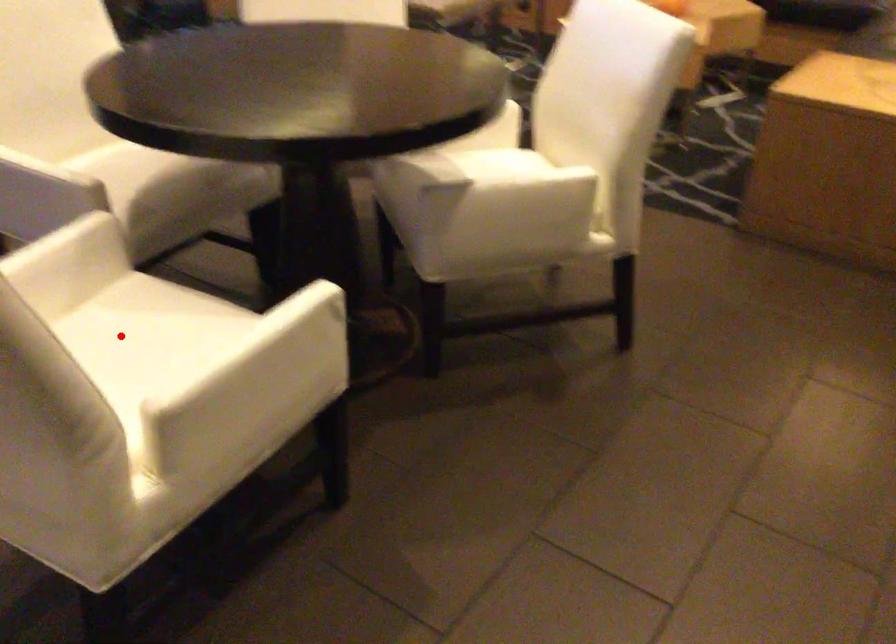
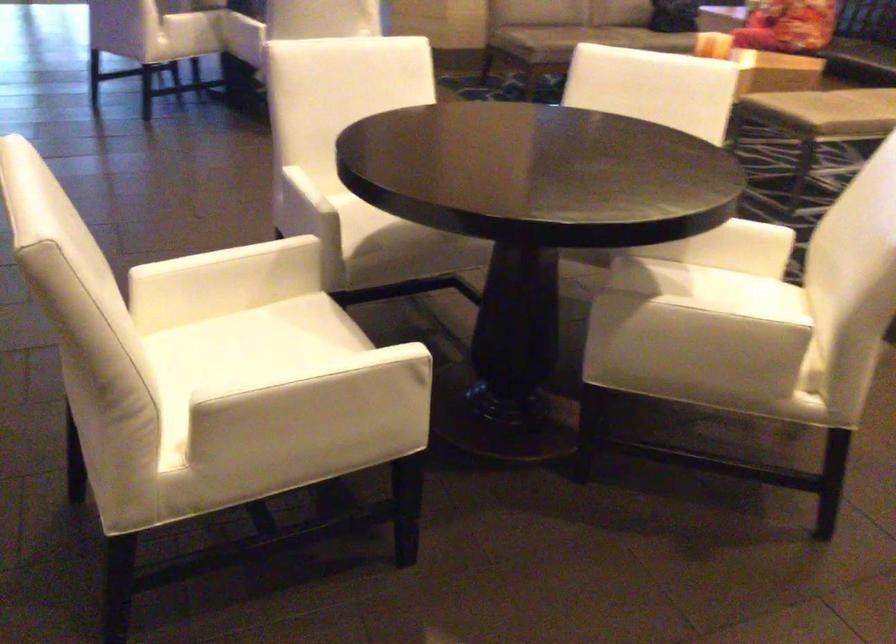
Where in the second image is the point corresponding to the highlighted location from the first image?

(259, 339)